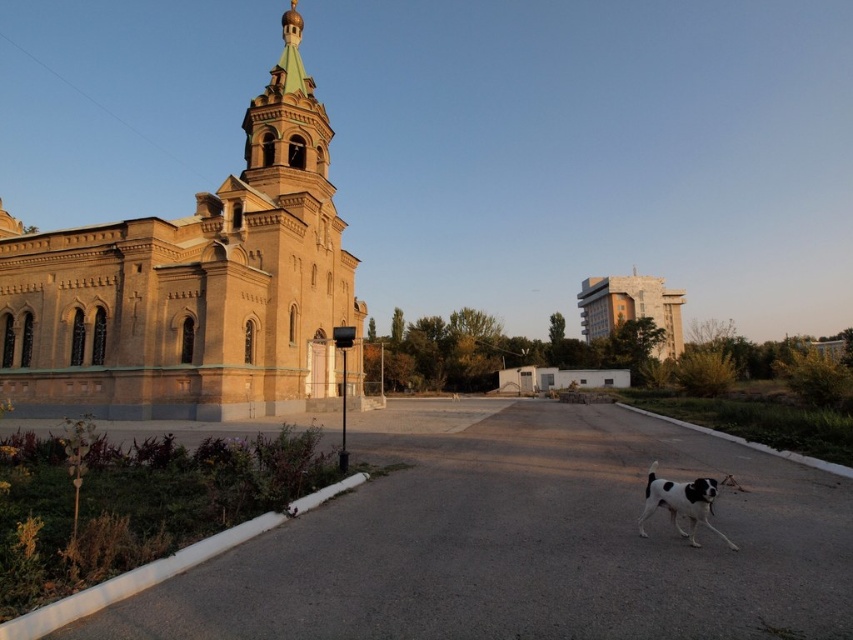
You are a photographer standing at the center of the paved area. You want to take a picture of the brown brick church at left and the black and white fur dog at lower right. Based on their positions, which object should appear larger in the photo?

The brown brick church at left appears larger in the photo because it is positioned above the black and white fur dog at lower right, indicating it is closer to the camera and thus larger in the frame.

Consider the image. You are standing at the entrance of the large ornate building with a green dome and gold cross. You want to locate the green copper spire at upper center. According to the coordinates provided, where should you look relative to the building?

The green copper spire at upper center is located at coordinates point [287,124], which means it is positioned slightly to the left and upper part of the image relative to the building.

You are standing in the paved area bordered by a low white curb and see the brown brick church at left and the black and white fur dog at lower right. Which object is taller?

The brown brick church at left is taller than the black and white fur dog at lower right.